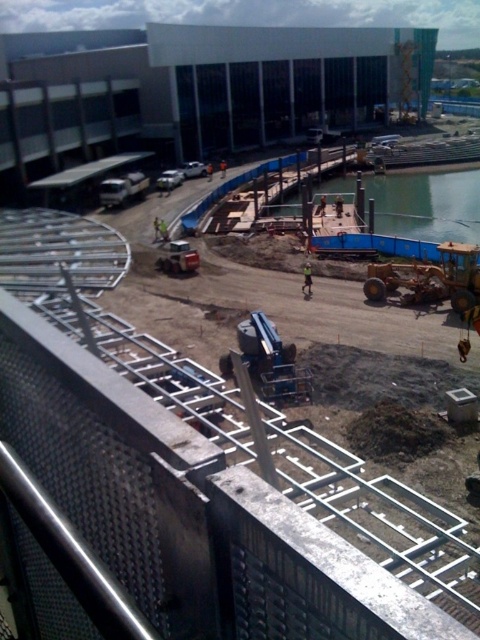
Question: Is yellow rubber tractor at lower right to the right of metallic blue truck at center from the viewer's perspective?

Choices:
 (A) no
 (B) yes

Answer: (B)

Question: Is the position of yellow rubber tractor at lower right more distant than that of metallic blue truck at center?

Choices:
 (A) no
 (B) yes

Answer: (A)

Question: Considering the relative positions of metallic blue crane at center and green reflective safety vest at center in the image provided, where is metallic blue crane at center located with respect to green reflective safety vest at center?

Choices:
 (A) above
 (B) below

Answer: (B)

Question: Which object appears closest to the camera in this image?

Choices:
 (A) metallic blue crane at center
 (B) yellow rubber tractor at lower right

Answer: (A)

Question: Which point appears farthest from the camera in this image?

Choices:
 (A) (478, 264)
 (B) (301, 289)

Answer: (B)

Question: Among these points, which one is nearest to the camera?

Choices:
 (A) (305, 269)
 (B) (162, 256)

Answer: (A)